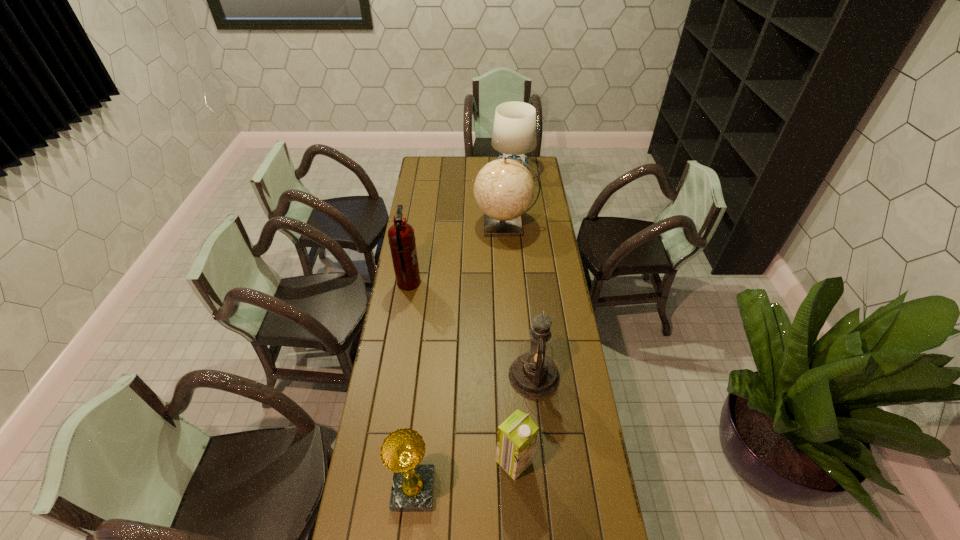
Where is `vacant area that lies between the oil lamp and the lampshade`? vacant area that lies between the oil lamp and the lampshade is located at coordinates (523, 274).

Identify which object is the closest to the fire extinguisher. Please provide its 2D coordinates. Your answer should be formatted as a tuple, i.e. [(x, y)], where the tuple contains the x and y coordinates of a point satisfying the conditions above.

[(504, 189)]

Find the location of a particular element. The height and width of the screenshot is (540, 960). object that stands as the fourth closest to the globe is located at coordinates (516, 438).

Where is `free spot that satisfies the following two spatial constraints: 1. on the front-facing side of the farthest object; 2. on the side of the fourth nearest object with the handle and hose`? This screenshot has height=540, width=960. free spot that satisfies the following two spatial constraints: 1. on the front-facing side of the farthest object; 2. on the side of the fourth nearest object with the handle and hose is located at coordinates (523, 283).

At what (x,y) coordinates should I click in order to perform the action: click on free space in the image that satisfies the following two spatial constraints: 1. on the surface of the globe showing Europe and Africa; 2. on the back side of the oil lamp. Please return your answer as a coordinate pair (x, y). Looking at the image, I should click on (515, 376).

Identify the location of blank space that satisfies the following two spatial constraints: 1. on the back side of the soya milk; 2. on the right side of the oil lamp. [x=510, y=376].

The image size is (960, 540). Find the location of `free location that satisfies the following two spatial constraints: 1. on the front side of the oil lamp; 2. on the front-facing side of the second object from left to right`. free location that satisfies the following two spatial constraints: 1. on the front side of the oil lamp; 2. on the front-facing side of the second object from left to right is located at coordinates (545, 490).